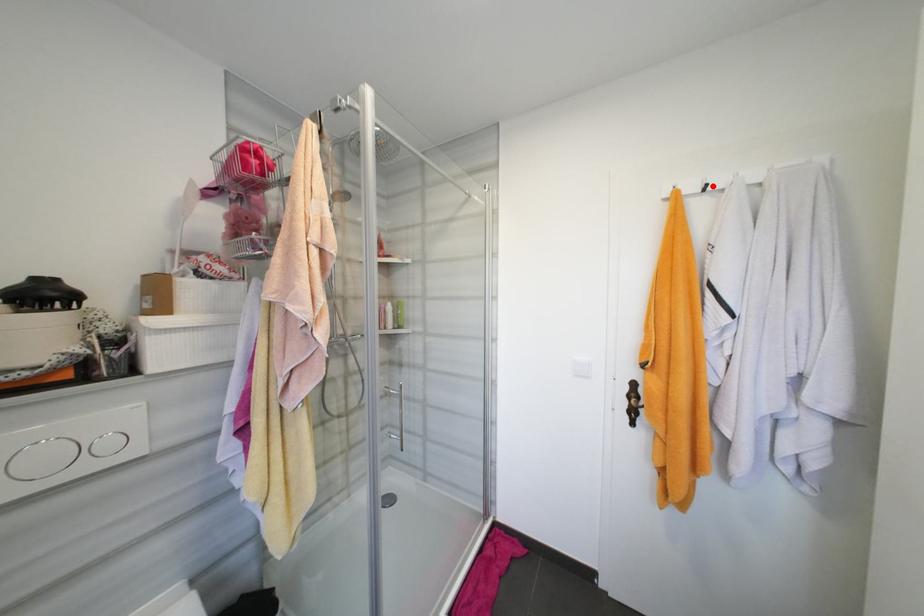
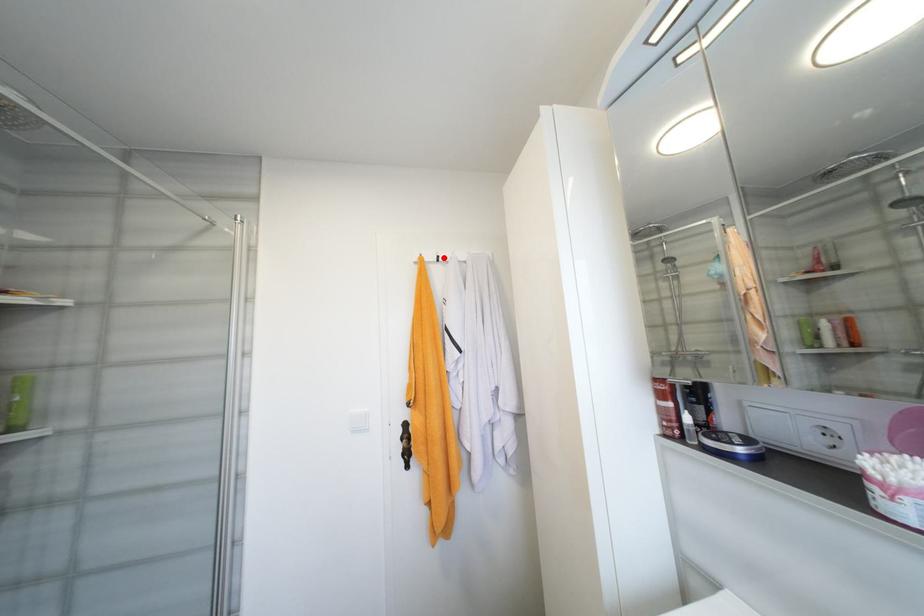
I am providing you with two images of the same scene from different viewpoints. A red point is marked on the first image and another point is marked on the second image. Do the highlighted points in image1 and image2 indicate the same real-world spot?

Yes